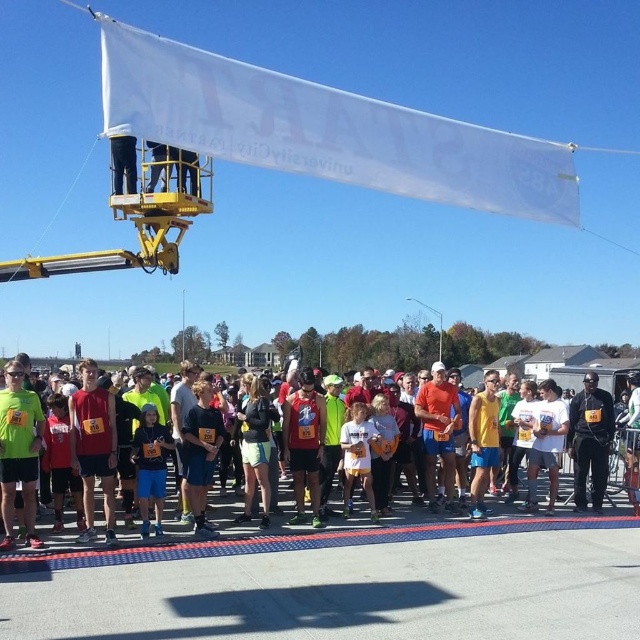
Does matte black shirt at center have a larger size compared to black matte pants at center?

Indeed, matte black shirt at center has a larger size compared to black matte pants at center.

Is matte black shirt at center shorter than black matte pants at center?

No.

What are the coordinates of `matte black shirt at center` in the screenshot? It's located at (493, 518).